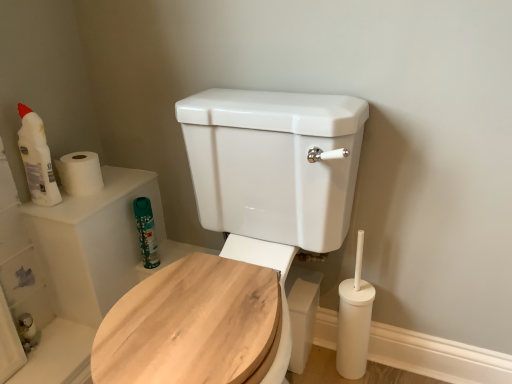
In order to face white matte toilet paper at upper left, should I rotate leftwards or rightwards?

Rotate left and turn 22.184 degrees.

The width and height of the screenshot is (512, 384). What do you see at coordinates (37, 159) in the screenshot?
I see `matte white bottle at upper left, placed as the 1th cleaning product when sorted from front to back` at bounding box center [37, 159].

What is the approximate height of matte white bottle at upper left, which is counted as the second cleaning product, starting from the bottom?

The height of matte white bottle at upper left, which is counted as the second cleaning product, starting from the bottom, is 27.59 centimeters.

Describe the element at coordinates (146, 232) in the screenshot. I see `green matte canister at upper left, which ranks as the 1th cleaning product in bottom-to-top order` at that location.

This screenshot has height=384, width=512. I want to click on white matte toilet paper at upper left, so click(x=80, y=173).

Is wooden toilet seat at center positioned before matte white bottle at upper left, which is counted as the second cleaning product, starting from the bottom?

Yes, wooden toilet seat at center is closer to the viewer.

Is matte white bottle at upper left, the first cleaning product when ordered from top to bottom, located within wooden toilet seat at center?

No, matte white bottle at upper left, the first cleaning product when ordered from top to bottom, is not a part of wooden toilet seat at center.

Does point (205, 340) come in front of point (29, 141)?

That is True.

Is wooden toilet seat at center wider than matte white bottle at upper left, placed as the 2th cleaning product when sorted from right to left?

Yes, wooden toilet seat at center is wider than matte white bottle at upper left, placed as the 2th cleaning product when sorted from right to left.

Which is in front, point (326, 158) or point (66, 158)?

The point (326, 158) is closer.

Choose the correct answer: Is wooden toilet seat at center inside white matte toilet paper at upper left or outside it?

wooden toilet seat at center cannot be found inside white matte toilet paper at upper left.

Looking at their sizes, would you say wooden toilet seat at center is wider or thinner than white matte toilet paper at upper left?

wooden toilet seat at center is wider than white matte toilet paper at upper left.

From a real-world perspective, is wooden toilet seat at center physically below white matte toilet paper at upper left?

Yes.

Is point (151, 208) behind point (91, 192)?

Yes, it is.

The height and width of the screenshot is (384, 512). Find the location of `toilet paper that is in front of the green matte canister at upper left, which is the first cleaning product from right to left`. toilet paper that is in front of the green matte canister at upper left, which is the first cleaning product from right to left is located at coordinates (80, 173).

Can you tell me how much green matte canister at upper left, arranged as the 1th cleaning product when viewed from the back, and white matte toilet paper at upper left differ in facing direction?

There is a 89.7-degree angle between the facing directions of green matte canister at upper left, arranged as the 1th cleaning product when viewed from the back, and white matte toilet paper at upper left.

From the image's perspective, would you say green matte canister at upper left, the 2th cleaning product viewed from the left, is positioned over white matte toilet paper at upper left?

Incorrect, from the image's perspective, green matte canister at upper left, the 2th cleaning product viewed from the left, is lower than white matte toilet paper at upper left.

Which object is thinner, green matte canister at upper left, marked as the second cleaning product in a front-to-back arrangement, or matte white bottle at upper left, placed as the 1th cleaning product when sorted from front to back?

Thinner between the two is green matte canister at upper left, marked as the second cleaning product in a front-to-back arrangement.

Can you confirm if green matte canister at upper left, the 2th cleaning product in the top-to-bottom sequence, is positioned to the right of matte white bottle at upper left, the first cleaning product when ordered from top to bottom?

Yes, green matte canister at upper left, the 2th cleaning product in the top-to-bottom sequence, is to the right of matte white bottle at upper left, the first cleaning product when ordered from top to bottom.

Who is shorter, green matte canister at upper left, which is the first cleaning product from right to left, or matte white bottle at upper left, the first cleaning product when ordered from top to bottom?

Standing shorter between the two is green matte canister at upper left, which is the first cleaning product from right to left.

Based on the photo, could you tell me if green matte canister at upper left, the 2th cleaning product in the top-to-bottom sequence, is facing matte white bottle at upper left, placed as the 2th cleaning product when sorted from right to left?

No, green matte canister at upper left, the 2th cleaning product in the top-to-bottom sequence, does not turn towards matte white bottle at upper left, placed as the 2th cleaning product when sorted from right to left.

Is matte white bottle at upper left, the 2th cleaning product when ordered from back to front, not near green matte canister at upper left, the 2th cleaning product viewed from the left?

Actually, matte white bottle at upper left, the 2th cleaning product when ordered from back to front, and green matte canister at upper left, the 2th cleaning product viewed from the left, are a little close together.

From the image's perspective, would you say matte white bottle at upper left, placed as the 1th cleaning product when sorted from left to right, is shown under green matte canister at upper left, which ranks as the 1th cleaning product in bottom-to-top order?

No, from the image's perspective, matte white bottle at upper left, placed as the 1th cleaning product when sorted from left to right, is not beneath green matte canister at upper left, which ranks as the 1th cleaning product in bottom-to-top order.

Between matte white bottle at upper left, placed as the 1th cleaning product when sorted from left to right, and green matte canister at upper left, the 2th cleaning product in the top-to-bottom sequence, which one has smaller width?

Thinner between the two is green matte canister at upper left, the 2th cleaning product in the top-to-bottom sequence.

From the image's perspective, is green matte canister at upper left, arranged as the 1th cleaning product when viewed from the back, on top of wooden toilet seat at center?

Yes.

Is wooden toilet seat at center at the back of green matte canister at upper left, which ranks as the 1th cleaning product in bottom-to-top order?

No, green matte canister at upper left, which ranks as the 1th cleaning product in bottom-to-top order, is not facing the opposite direction of wooden toilet seat at center.

Can you confirm if green matte canister at upper left, the 2th cleaning product in the top-to-bottom sequence, is thinner than wooden toilet seat at center?

Indeed, green matte canister at upper left, the 2th cleaning product in the top-to-bottom sequence, has a lesser width compared to wooden toilet seat at center.

From a real-world perspective, who is located higher, green matte canister at upper left, arranged as the 1th cleaning product when viewed from the back, or wooden toilet seat at center?

wooden toilet seat at center, from a real-world perspective.

Could you tell me if matte white bottle at upper left, placed as the 1th cleaning product when sorted from front to back, is turned towards white matte toilet paper at upper left?

No, matte white bottle at upper left, placed as the 1th cleaning product when sorted from front to back, is not oriented towards white matte toilet paper at upper left.

Between matte white bottle at upper left, which is counted as the second cleaning product, starting from the bottom, and white matte toilet paper at upper left, which one has more height?

Standing taller between the two is matte white bottle at upper left, which is counted as the second cleaning product, starting from the bottom.

Does matte white bottle at upper left, placed as the 1th cleaning product when sorted from front to back, have a larger size compared to white matte toilet paper at upper left?

Indeed, matte white bottle at upper left, placed as the 1th cleaning product when sorted from front to back, has a larger size compared to white matte toilet paper at upper left.

Locate an element on the screen. cleaning product located above the wooden toilet seat at center (from a real-world perspective) is located at coordinates (37, 159).

Locate an element on the screen. toilet paper above the wooden toilet seat at center (from the image's perspective) is located at coordinates (80, 173).

Estimate the real-world distances between objects in this image. Which object is closer to wooden toilet seat at center, white matte toilet paper at upper left or matte white bottle at upper left, placed as the 1th cleaning product when sorted from front to back?

white matte toilet paper at upper left is closer to wooden toilet seat at center.

Estimate the real-world distances between objects in this image. Which object is further from green matte canister at upper left, the 2th cleaning product viewed from the left, white matte toilet paper at upper left or matte white bottle at upper left, the 2th cleaning product when ordered from back to front?

matte white bottle at upper left, the 2th cleaning product when ordered from back to front.

Estimate the real-world distances between objects in this image. Which object is further from matte white bottle at upper left, the 2th cleaning product when ordered from back to front, green matte canister at upper left, the 2th cleaning product viewed from the left, or white matte toilet paper at upper left?

green matte canister at upper left, the 2th cleaning product viewed from the left, is further to matte white bottle at upper left, the 2th cleaning product when ordered from back to front.

Looking at the image, which one is located closer to wooden toilet seat at center, green matte canister at upper left, which ranks as the 1th cleaning product in bottom-to-top order, or white matte toilet paper at upper left?

Based on the image, green matte canister at upper left, which ranks as the 1th cleaning product in bottom-to-top order, appears to be nearer to wooden toilet seat at center.

Based on their spatial positions, is matte white bottle at upper left, placed as the 2th cleaning product when sorted from right to left, or wooden toilet seat at center further from green matte canister at upper left, the 2th cleaning product viewed from the left?

The object further to green matte canister at upper left, the 2th cleaning product viewed from the left, is wooden toilet seat at center.

When comparing their distances from matte white bottle at upper left, which is counted as the second cleaning product, starting from the bottom, does wooden toilet seat at center or green matte canister at upper left, the 2th cleaning product viewed from the left, seem further?

The object further to matte white bottle at upper left, which is counted as the second cleaning product, starting from the bottom, is wooden toilet seat at center.

Looking at the image, which one is located closer to matte white bottle at upper left, placed as the 1th cleaning product when sorted from front to back, white matte toilet paper at upper left or wooden toilet seat at center?

white matte toilet paper at upper left.

From the image, which object appears to be farther from wooden toilet seat at center, matte white bottle at upper left, placed as the 1th cleaning product when sorted from front to back, or white matte toilet paper at upper left?

Based on the image, matte white bottle at upper left, placed as the 1th cleaning product when sorted from front to back, appears to be further to wooden toilet seat at center.

Where is `toilet paper located between wooden toilet seat at center and green matte canister at upper left, arranged as the 1th cleaning product when viewed from the back, in the depth direction`? The width and height of the screenshot is (512, 384). toilet paper located between wooden toilet seat at center and green matte canister at upper left, arranged as the 1th cleaning product when viewed from the back, in the depth direction is located at coordinates (80, 173).

Locate an element on the screen. Image resolution: width=512 pixels, height=384 pixels. cleaning product between wooden toilet seat at center and white matte toilet paper at upper left along the z-axis is located at coordinates (37, 159).

In order to click on cleaning product between wooden toilet seat at center and green matte canister at upper left, the 2th cleaning product in the top-to-bottom sequence, along the z-axis in this screenshot , I will do `click(37, 159)`.

Find the location of a particular element. The width and height of the screenshot is (512, 384). toilet paper located between matte white bottle at upper left, placed as the 2th cleaning product when sorted from right to left, and green matte canister at upper left, marked as the second cleaning product in a front-to-back arrangement, in the left-right direction is located at coordinates (80, 173).